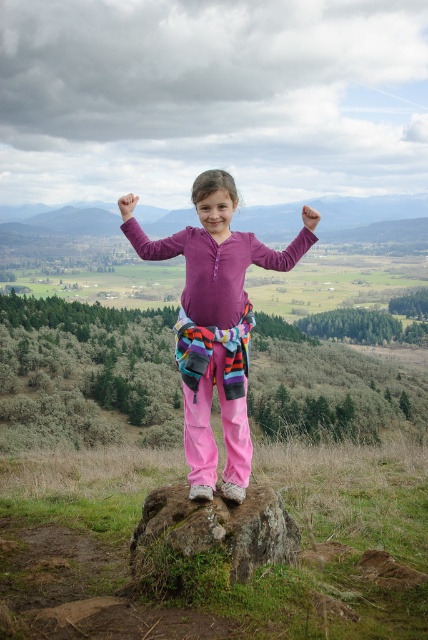
Question: Is green mossy rock at center behind purple fleece arm at center?

Choices:
 (A) no
 (B) yes

Answer: (A)

Question: Where is matte purple sweater at center located in relation to purple matte shirt at center in the image?

Choices:
 (A) above
 (B) below

Answer: (B)

Question: Which point is closer to the camera taking this photo?

Choices:
 (A) (235, 273)
 (B) (130, 204)
 (C) (261, 552)

Answer: (A)

Question: Which point appears farthest from the camera in this image?

Choices:
 (A) (131, 205)
 (B) (154, 525)
 (C) (303, 241)

Answer: (C)

Question: Is matte purple sweater at center below purple matte shirt at center?

Choices:
 (A) no
 (B) yes

Answer: (B)

Question: Estimate the real-world distances between objects in this image. Which object is farther from the purple fleece arm at center?

Choices:
 (A) green mossy rock at center
 (B) purple matte shirt at center

Answer: (B)